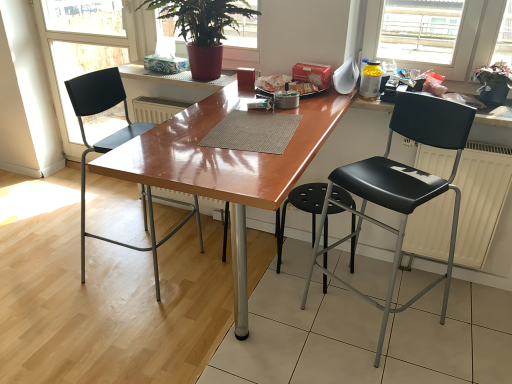
Question: Is green leafy plant at upper right, which is the 2th houseplant in left-to-right order, to the left of white matte radiator at right from the viewer's perspective?

Choices:
 (A) yes
 (B) no

Answer: (B)

Question: Considering the relative sizes of green leafy plant at upper right, which ranks as the first houseplant in right-to-left order, and white matte radiator at right in the image provided, is green leafy plant at upper right, which ranks as the first houseplant in right-to-left order, taller than white matte radiator at right?

Choices:
 (A) no
 (B) yes

Answer: (A)

Question: Is green leafy plant at upper right, which is the 2th houseplant in left-to-right order, smaller than white matte radiator at right?

Choices:
 (A) yes
 (B) no

Answer: (A)

Question: From the image's perspective, is green leafy plant at upper right, which ranks as the first houseplant in right-to-left order, above white matte radiator at right?

Choices:
 (A) no
 (B) yes

Answer: (B)

Question: Is green leafy plant at upper right, which ranks as the first houseplant in right-to-left order, directly adjacent to white matte radiator at right?

Choices:
 (A) no
 (B) yes

Answer: (A)

Question: In the image, is yellow translucent bottle at upper right on the left side or the right side of white matte radiator at right?

Choices:
 (A) left
 (B) right

Answer: (A)

Question: Considering the positions of yellow translucent bottle at upper right and white matte radiator at right in the image, is yellow translucent bottle at upper right taller or shorter than white matte radiator at right?

Choices:
 (A) short
 (B) tall

Answer: (A)

Question: Looking at their shapes, would you say yellow translucent bottle at upper right is wider or thinner than white matte radiator at right?

Choices:
 (A) thin
 (B) wide

Answer: (B)

Question: Is yellow translucent bottle at upper right bigger or smaller than white matte radiator at right?

Choices:
 (A) big
 (B) small

Answer: (B)

Question: From a real-world perspective, is matte black chair at left physically located above or below black leather chair at right, marked as the first chair in a right-to-left arrangement?

Choices:
 (A) above
 (B) below

Answer: (A)

Question: Choose the correct answer: Is matte black chair at left inside black leather chair at right, the second chair from the left, or outside it?

Choices:
 (A) inside
 (B) outside

Answer: (B)

Question: In the image, is matte black chair at left on the left side or the right side of black leather chair at right, the second chair from the left?

Choices:
 (A) left
 (B) right

Answer: (A)

Question: In terms of width, does matte black chair at left look wider or thinner when compared to black leather chair at right, the second chair from the left?

Choices:
 (A) thin
 (B) wide

Answer: (A)

Question: Would you say black plastic chair at left, the 1th chair when ordered from left to right, is to the left or to the right of matte black chair at left in the picture?

Choices:
 (A) right
 (B) left

Answer: (A)

Question: From a real-world perspective, is black plastic chair at left, the 1th chair when ordered from left to right, physically located above or below matte black chair at left?

Choices:
 (A) below
 (B) above

Answer: (A)